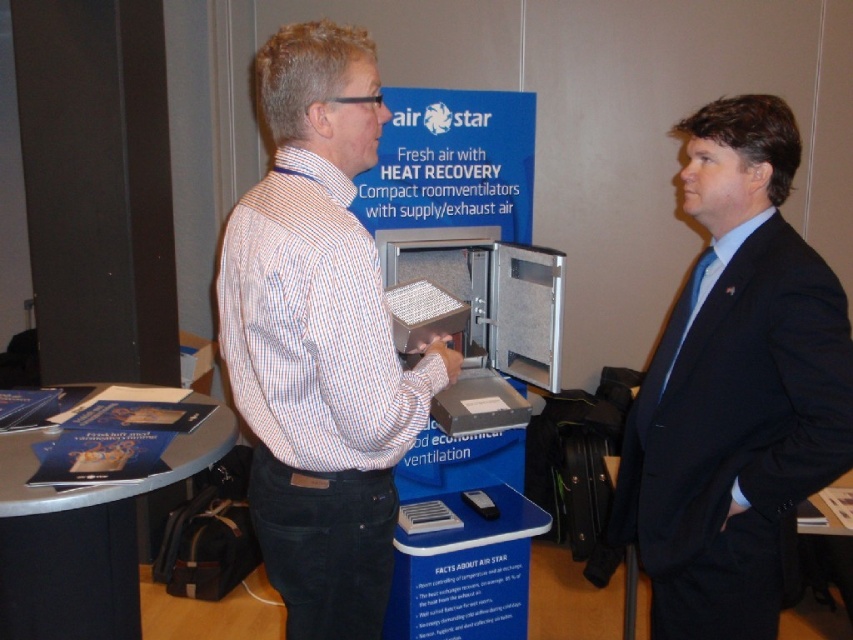
What is the color of the suit worn by the person standing at the coordinates point [735,388]?

The person at point [735,388] is wearing a dark blue suit.

You are standing at the center of the image and want to move towards the dark blue suit at right. Which direction should you move?

You should move towards the right side of the image to reach the dark blue suit at right.

You are a photographer at the event and want to take a group photo of the two people. The camera you are using has a limited focus range. Which person should you position closer to ensure they are in focus, the white striped shirt at center or the dark blue suit at right?

The white striped shirt at center is bigger than the dark blue suit at right, so you should position the white striped shirt at center closer to ensure they are in focus.